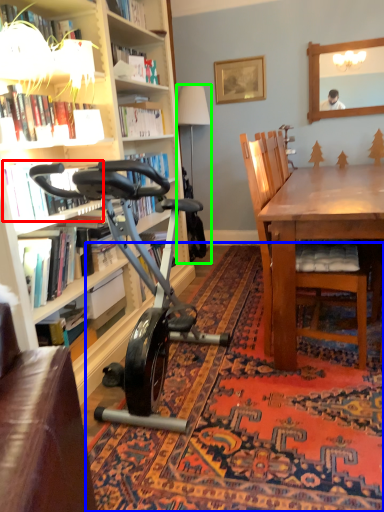
Question: Which object is the closest to the book (highlighted by a red box)? Choose among these: mat (highlighted by a blue box) or lamp (highlighted by a green box).

Choices:
 (A) mat
 (B) lamp

Answer: (A)